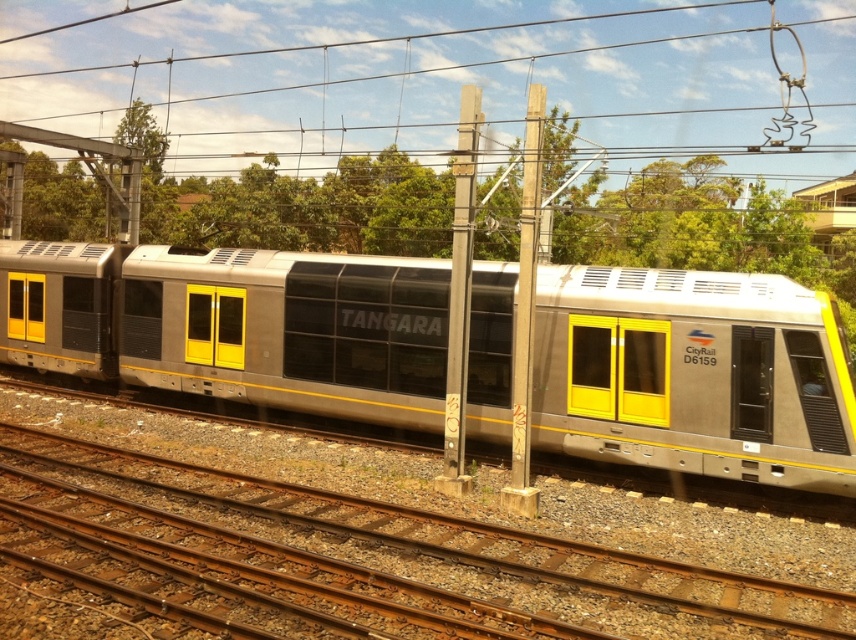
You are standing at the point labeled as point (235, 324) in the image. What object are you currently standing on?

The point (235, 324) is on metallic silver train at center, so you are standing on the metallic silver train at center.

You are a maintenance worker inspecting the train area. You notice the metallic wire at upper center and the smooth wood pole at center. Which object is positioned higher in the scene?

The metallic wire at upper center is above the smooth wood pole at center, so it is positioned higher in the scene.